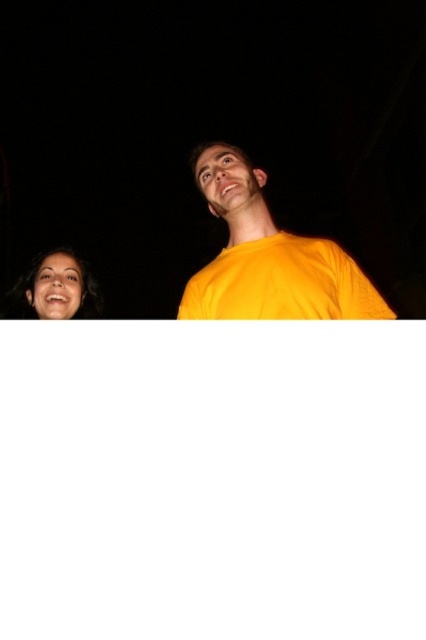
Does yellow matte shirt at center appear under matte black face at lower left?

No, yellow matte shirt at center is not below matte black face at lower left.

Who is shorter, yellow matte shirt at center or matte black face at lower left?

With less height is matte black face at lower left.

Does point (314, 268) lie in front of point (23, 276)?

Yes, point (314, 268) is closer to viewer.

I want to click on yellow matte shirt at center, so click(x=268, y=257).